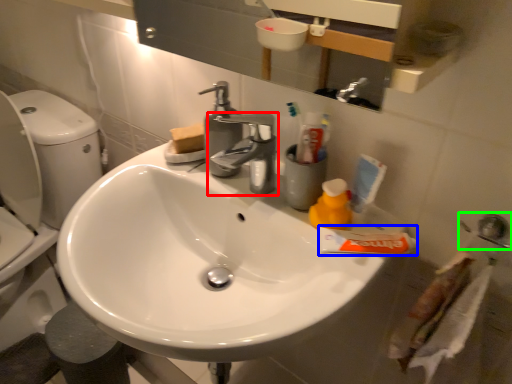
Question: Which object is the farthest from tap (highlighted by a red box)? Choose among these: toothpaste (highlighted by a blue box) or plumbing fixture (highlighted by a green box).

Choices:
 (A) toothpaste
 (B) plumbing fixture

Answer: (B)